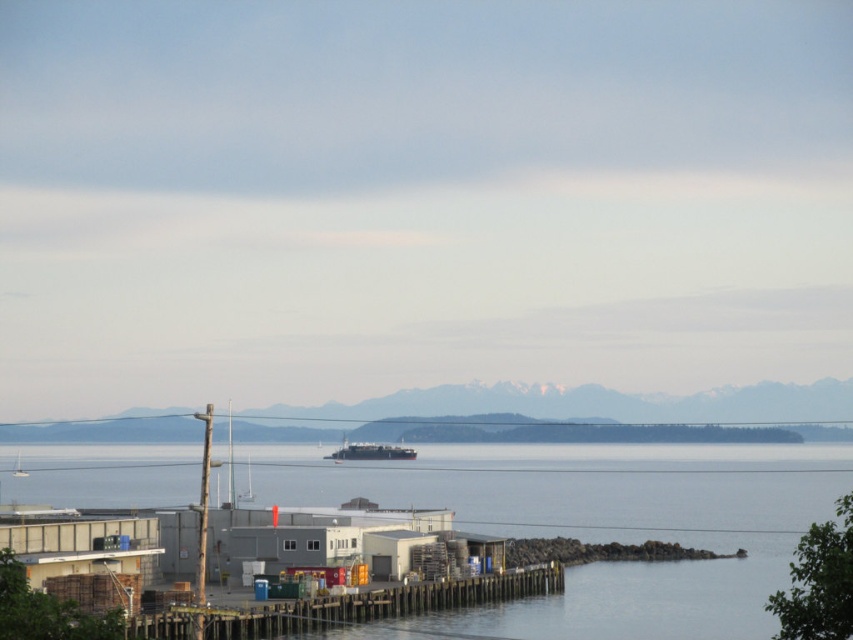
Question: Among these objects, which one is farthest from the camera?

Choices:
 (A) clear water at dock center
 (B) metallic gray barge at center

Answer: (B)

Question: Which point is closer to the camera taking this photo?

Choices:
 (A) (635, 497)
 (B) (387, 451)
 (C) (444, 588)

Answer: (C)

Question: Can you confirm if clear water at dock center is thinner than wooden at lower left?

Choices:
 (A) no
 (B) yes

Answer: (A)

Question: Where is clear water at dock center located in relation to metallic gray barge at center in the image?

Choices:
 (A) below
 (B) above

Answer: (B)

Question: From the image, what is the correct spatial relationship of clear water at dock center in relation to wooden at lower left?

Choices:
 (A) left
 (B) right

Answer: (B)

Question: Which object is positioned farthest from the clear water at dock center?

Choices:
 (A) wooden at lower left
 (B) metallic gray barge at center

Answer: (A)